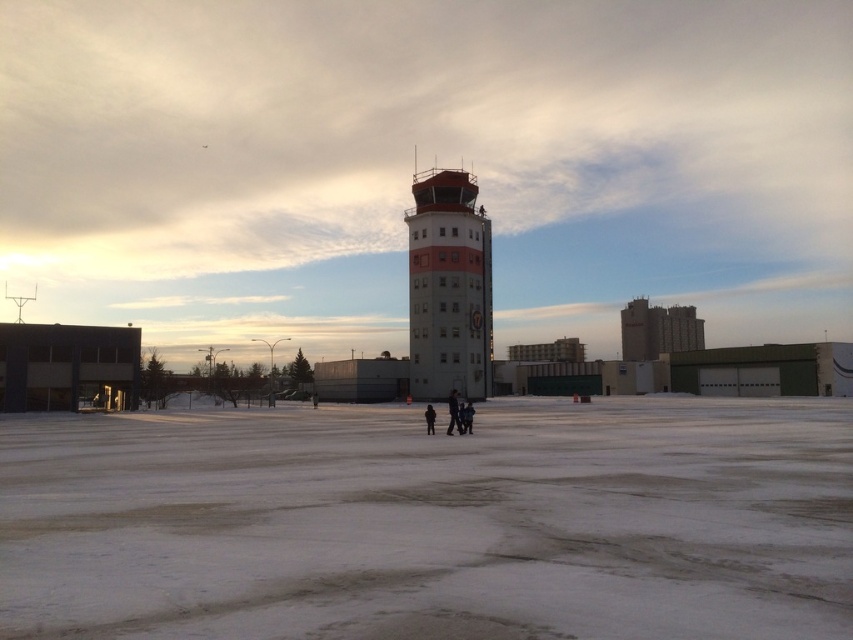
You are a drone operator preparing to land a drone on the white powdery snow at center near the white concrete control tower at center. Considering the size difference between the two, which area would provide a more stable landing surface?

The white concrete control tower at center has a larger size compared to the white powdery snow at center, so the control tower would provide a more stable landing surface for the drone.

You are a drone operator who needs to fly a drone from the white powdery snow at center to the white concrete control tower at center. The drone has a maximum flight distance of 200 feet. Can the drone complete the flight without needing to recharge?

The white powdery snow at center and white concrete control tower at center are 186.55 feet apart from each other. Since the drone can fly up to 200 feet, it can complete the flight without needing to recharge.

You are a pilot trying to land a small plane on the snowy field. You see the white powdery snow at center and the white concrete control tower at center. Which object is closer to the left side of your view?

The white powdery snow at center is to the left of the white concrete control tower at center, so it is closer to the left side of your view.